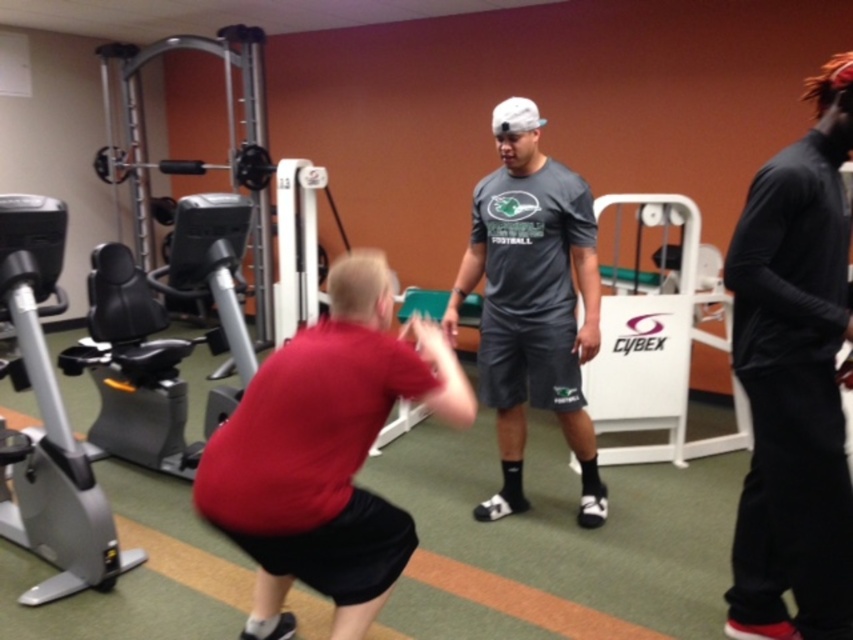
You are a gym member who wants to use the white plastic cybex machine at center. However, you see the silver metallic exercise bike at left is currently occupied. Can you move the exercise bike to the right to make space for the cybex machine?

The silver metallic exercise bike at left is already positioned to the left of the white plastic cybex machine at center, so there is no need to move it to make space.